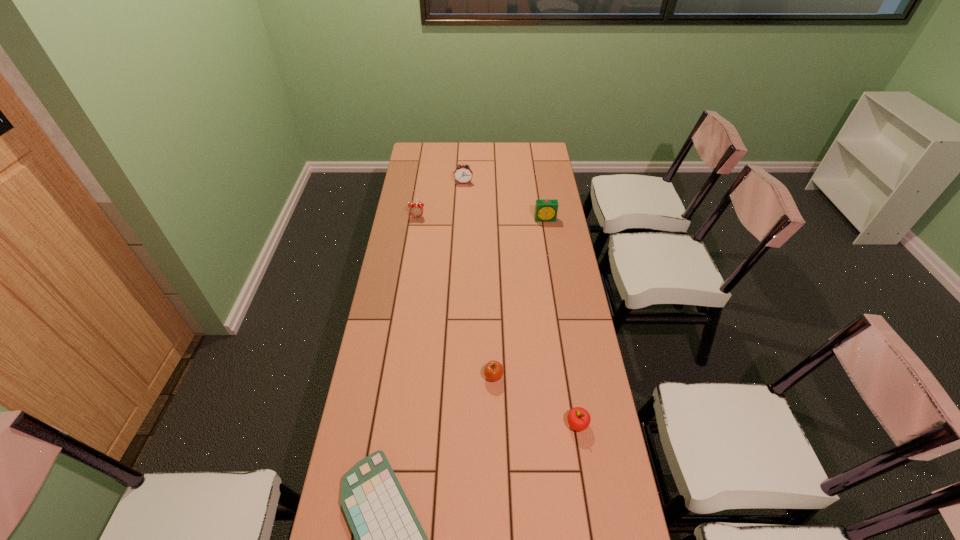
This screenshot has width=960, height=540. I want to click on vacant space that's between the rightmost alarm clock and the leftmost alarm clock, so click(482, 218).

You are a GUI agent. You are given a task and a screenshot of the screen. Output one action in this format:
    pyautogui.click(x=<x>, y=<y>)
    Task: Click on the free spot between the leftmost alarm clock and the second nearest object
    This screenshot has width=960, height=540.
    Given the screenshot: What is the action you would take?
    pyautogui.click(x=497, y=321)

Where is `free space between the rightmost alarm clock and the farthest alarm clock`? free space between the rightmost alarm clock and the farthest alarm clock is located at coordinates (505, 201).

Choose which object is the fourth nearest neighbor to the leftmost alarm clock. Please provide its 2D coordinates. Your answer should be formatted as a tuple, i.e. [(x, y)], where the tuple contains the x and y coordinates of a point satisfying the conditions above.

[(389, 539)]

At what (x,y) coordinates should I click in order to perform the action: click on the fifth closest object relative to the right apple. Please return your answer as a coordinate pair (x, y). This screenshot has width=960, height=540. Looking at the image, I should click on point(463,174).

Choose which alarm clock is the nearest neighbor to the rightmost alarm clock. Please provide its 2D coordinates. Your answer should be formatted as a tuple, i.e. [(x, y)], where the tuple contains the x and y coordinates of a point satisfying the conditions above.

[(463, 174)]

The width and height of the screenshot is (960, 540). Find the location of `the closest alarm clock to the farthest alarm clock`. the closest alarm clock to the farthest alarm clock is located at coordinates [x=416, y=210].

You are a GUI agent. You are given a task and a screenshot of the screen. Output one action in this format:
    pyautogui.click(x=<x>, y=<y>)
    Task: Click on the free space that satisfies the following two spatial constraints: 1. on the front side of the third nearest object; 2. on the left side of the right apple
    This screenshot has width=960, height=540.
    Given the screenshot: What is the action you would take?
    [494, 424]

This screenshot has height=540, width=960. Identify the location of free space that satisfies the following two spatial constraints: 1. on the clock face of the farthest object; 2. on the left side of the nearer apple. (453, 424).

This screenshot has height=540, width=960. Find the location of `vacant region that satisfies the following two spatial constraints: 1. on the face of the farther apple; 2. on the right side of the leftmost alarm clock`. vacant region that satisfies the following two spatial constraints: 1. on the face of the farther apple; 2. on the right side of the leftmost alarm clock is located at coordinates (393, 376).